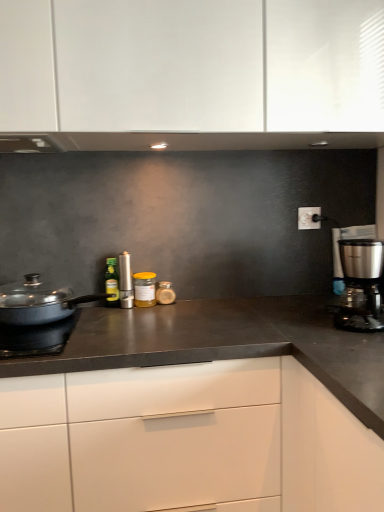
What do you see at coordinates (359, 282) in the screenshot?
I see `satin silver coffee maker at right, the fifth kitchen appliance positioned from the left` at bounding box center [359, 282].

This screenshot has height=512, width=384. What do you see at coordinates (125, 281) in the screenshot?
I see `satin silver canister at center, the fourth kitchen appliance positioned from the back` at bounding box center [125, 281].

Describe the element at coordinates (39, 301) in the screenshot. I see `matte black pan at left` at that location.

This screenshot has width=384, height=512. I want to click on translucent glass jar at center, marked as the fourth kitchen appliance in a left-to-right arrangement, so click(165, 293).

Is matte black pan at left smaller than yellow glass jar at center, the third kitchen appliance from the back?

Incorrect, matte black pan at left is not smaller in size than yellow glass jar at center, the third kitchen appliance from the back.

Considering the positions of objects matte black pan at left and yellow glass jar at center, marked as the third kitchen appliance in a right-to-left arrangement, in the image provided, who is in front, matte black pan at left or yellow glass jar at center, marked as the third kitchen appliance in a right-to-left arrangement,?

Positioned in front is matte black pan at left.

From a real-world perspective, is matte black pan at left over yellow glass jar at center, the third kitchen appliance from the back?

No, from a real-world perspective, matte black pan at left is not above yellow glass jar at center, the third kitchen appliance from the back.

Is matte black pan at left next to yellow glass jar at center, which is the 3th kitchen appliance in front-to-back order, and touching it?

They are not placed beside each other.

From the picture: Considering the relative sizes of yellow glass jar at center, which ranks as the 3th kitchen appliance in left-to-right order, and matte black pan at left in the image provided, is yellow glass jar at center, which ranks as the 3th kitchen appliance in left-to-right order, shorter than matte black pan at left?

Incorrect, the height of yellow glass jar at center, which ranks as the 3th kitchen appliance in left-to-right order, does not fall short of that of matte black pan at left.

I want to click on the 3rd kitchen appliance counting from the right side of the matte black pan at left, so pyautogui.click(x=144, y=289).

Is the position of yellow glass jar at center, which is the 3th kitchen appliance in front-to-back order, less distant than that of matte black pan at left?

No, yellow glass jar at center, which is the 3th kitchen appliance in front-to-back order, is further to the viewer.

Which is closer to the camera, (x=139, y=304) or (x=11, y=357)?

The point (x=11, y=357) is in front.

From a real-world perspective, is matte black pan at left under green glass bottle at center, marked as the fourth kitchen appliance in a front-to-back arrangement?

Indeed, from a real-world perspective, matte black pan at left is positioned beneath green glass bottle at center, marked as the fourth kitchen appliance in a front-to-back arrangement.

Consider the image. Which point is more forward, [38,279] or [116,295]?

The point [38,279] is closer.

Can you tell me how much matte black pan at left and green glass bottle at center, the 5th kitchen appliance in the right-to-left sequence, differ in facing direction?

The angular difference between matte black pan at left and green glass bottle at center, the 5th kitchen appliance in the right-to-left sequence, is 1.18 degrees.

In terms of height, does matte black pan at left look taller or shorter compared to green glass bottle at center, which appears as the first kitchen appliance when viewed from the left?

In the image, matte black pan at left appears to be shorter than green glass bottle at center, which appears as the first kitchen appliance when viewed from the left.

Between yellow glass jar at center, the third kitchen appliance from the back, and satin silver canister at center, arranged as the second kitchen appliance when viewed from the front, which one has smaller width?

With smaller width is satin silver canister at center, arranged as the second kitchen appliance when viewed from the front.

Does yellow glass jar at center, marked as the third kitchen appliance in a right-to-left arrangement, turn towards satin silver canister at center, the fourth kitchen appliance positioned from the back?

No, yellow glass jar at center, marked as the third kitchen appliance in a right-to-left arrangement, is not facing towards satin silver canister at center, the fourth kitchen appliance positioned from the back.

Starting from the satin silver canister at center, the fourth kitchen appliance positioned from the back, which kitchen appliance is the 1st one behind? Please provide its 2D coordinates.

[(144, 289)]

Which is in front, point (138, 303) or point (131, 288)?

Positioned in front is point (138, 303).

Is green glass bottle at center, which appears as the first kitchen appliance when viewed from the left, not close to matte black pan at left?

green glass bottle at center, which appears as the first kitchen appliance when viewed from the left, is actually quite close to matte black pan at left.

Is green glass bottle at center, which appears as the first kitchen appliance when viewed from the left, bigger than matte black pan at left?

Actually, green glass bottle at center, which appears as the first kitchen appliance when viewed from the left, might be smaller than matte black pan at left.

Is matte black pan at left located within green glass bottle at center, the 5th kitchen appliance in the right-to-left sequence?

No, green glass bottle at center, the 5th kitchen appliance in the right-to-left sequence, does not contain matte black pan at left.

Which is more to the left, white matte cabinet at center or satin silver canister at center, the second kitchen appliance when ordered from left to right?

Positioned to the left is satin silver canister at center, the second kitchen appliance when ordered from left to right.

Based on the photo, considering the sizes of objects white matte cabinet at center and satin silver canister at center, arranged as the second kitchen appliance when viewed from the front, in the image provided, who is thinner, white matte cabinet at center or satin silver canister at center, arranged as the second kitchen appliance when viewed from the front,?

A: satin silver canister at center, arranged as the second kitchen appliance when viewed from the front.

Which of these two, white matte cabinet at center or satin silver canister at center, the second kitchen appliance when ordered from left to right, stands shorter?

satin silver canister at center, the second kitchen appliance when ordered from left to right, is shorter.

Which of these two, translucent glass jar at center, which appears as the 5th kitchen appliance when viewed from the front, or satin silver coffee maker at right, the fifth kitchen appliance positioned from the left, stands taller?

satin silver coffee maker at right, the fifth kitchen appliance positioned from the left, is taller.

From a real-world perspective, which is physically above, translucent glass jar at center, acting as the 2th kitchen appliance starting from the right, or satin silver coffee maker at right, the first kitchen appliance viewed from the front?

satin silver coffee maker at right, the first kitchen appliance viewed from the front, is physically above.

From the picture: Could you tell me if translucent glass jar at center, marked as the 1th kitchen appliance in a back-to-front arrangement, is facing satin silver coffee maker at right, the 1th kitchen appliance viewed from the right?

No, translucent glass jar at center, marked as the 1th kitchen appliance in a back-to-front arrangement, is not turned towards satin silver coffee maker at right, the 1th kitchen appliance viewed from the right.

Who is smaller, translucent glass jar at center, marked as the fourth kitchen appliance in a left-to-right arrangement, or satin silver coffee maker at right, which ranks as the 5th kitchen appliance in back-to-front order?

translucent glass jar at center, marked as the fourth kitchen appliance in a left-to-right arrangement, is smaller.

Find the location of a particular element. gas stove in front of the yellow glass jar at center, the third kitchen appliance from the back is located at coordinates (36, 338).

Find the location of a particular element. Image resolution: width=384 pixels, height=512 pixels. gas stove below the yellow glass jar at center, which is the 3th kitchen appliance in front-to-back order (from a real-world perspective) is located at coordinates (36, 338).

Looking at the image, which one is located further to satin silver coffee maker at right, the 1th kitchen appliance viewed from the right, yellow glass jar at center, the third kitchen appliance from the back, or translucent glass jar at center, which appears as the 5th kitchen appliance when viewed from the front?

yellow glass jar at center, the third kitchen appliance from the back, lies further to satin silver coffee maker at right, the 1th kitchen appliance viewed from the right, than the other object.

From the picture: Considering their positions, is matte black pan at left positioned further to translucent glass jar at center, acting as the 2th kitchen appliance starting from the right, than green glass bottle at center, the 5th kitchen appliance in the right-to-left sequence?

The object further to translucent glass jar at center, acting as the 2th kitchen appliance starting from the right, is matte black pan at left.

Based on their spatial positions, is yellow glass jar at center, which is the 3th kitchen appliance in front-to-back order, or matte black pan at left further from satin silver canister at center, arranged as the second kitchen appliance when viewed from the front?

Based on the image, matte black pan at left appears to be further to satin silver canister at center, arranged as the second kitchen appliance when viewed from the front.

Based on their spatial positions, is green glass bottle at center, the 5th kitchen appliance in the right-to-left sequence, or translucent glass jar at center, marked as the 1th kitchen appliance in a back-to-front arrangement, closer to matte black pan at left?

green glass bottle at center, the 5th kitchen appliance in the right-to-left sequence.

Looking at the image, which one is located further to satin silver coffee maker at right, the first kitchen appliance viewed from the front, white matte cabinet at center or green glass bottle at center, the 5th kitchen appliance in the right-to-left sequence?

green glass bottle at center, the 5th kitchen appliance in the right-to-left sequence, is further to satin silver coffee maker at right, the first kitchen appliance viewed from the front.

Looking at the image, which one is located further to matte black pan at left, satin silver canister at center, the fourth kitchen appliance positioned from the back, or yellow glass jar at center, marked as the third kitchen appliance in a right-to-left arrangement?

The object further to matte black pan at left is yellow glass jar at center, marked as the third kitchen appliance in a right-to-left arrangement.

Looking at the image, which one is located closer to yellow glass jar at center, the third kitchen appliance from the back, satin silver canister at center, the fourth kitchen appliance viewed from the right, or matte black pan at left?

satin silver canister at center, the fourth kitchen appliance viewed from the right.

Which object lies nearer to the anchor point satin silver canister at center, arranged as the second kitchen appliance when viewed from the front, yellow glass jar at center, which is the 3th kitchen appliance in front-to-back order, or translucent glass jar at center, acting as the 2th kitchen appliance starting from the right?

yellow glass jar at center, which is the 3th kitchen appliance in front-to-back order, is closer to satin silver canister at center, arranged as the second kitchen appliance when viewed from the front.

This screenshot has height=512, width=384. What are the coordinates of `home appliance between matte black pan at left and translucent glass jar at center, which appears as the 5th kitchen appliance when viewed from the front, from front to back` in the screenshot? It's located at (39, 301).

At what (x,y) coordinates should I click in order to perform the action: click on kitchen appliance between yellow glass jar at center, which ranks as the 3th kitchen appliance in left-to-right order, and satin silver coffee maker at right, the first kitchen appliance viewed from the front. Please return your answer as a coordinate pair (x, y). This screenshot has width=384, height=512. Looking at the image, I should click on (165, 293).

I want to click on cabinetry between green glass bottle at center, the 5th kitchen appliance in the right-to-left sequence, and satin silver coffee maker at right, the first kitchen appliance viewed from the front, in the horizontal direction, so click(185, 441).

Image resolution: width=384 pixels, height=512 pixels. In order to click on kitchen appliance between matte black pan at left and yellow glass jar at center, which ranks as the 3th kitchen appliance in left-to-right order, in the front-back direction in this screenshot , I will do `click(125, 281)`.